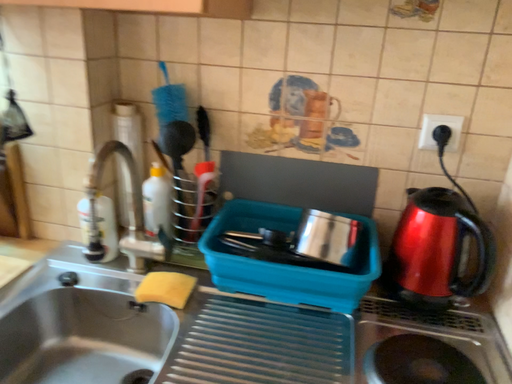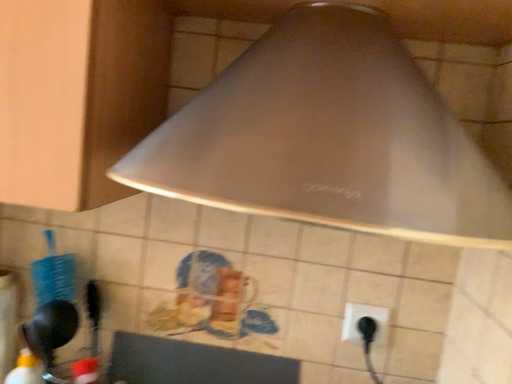
Question: Which way did the camera rotate in the video?

Choices:
 (A) rotated left
 (B) rotated right

Answer: (B)